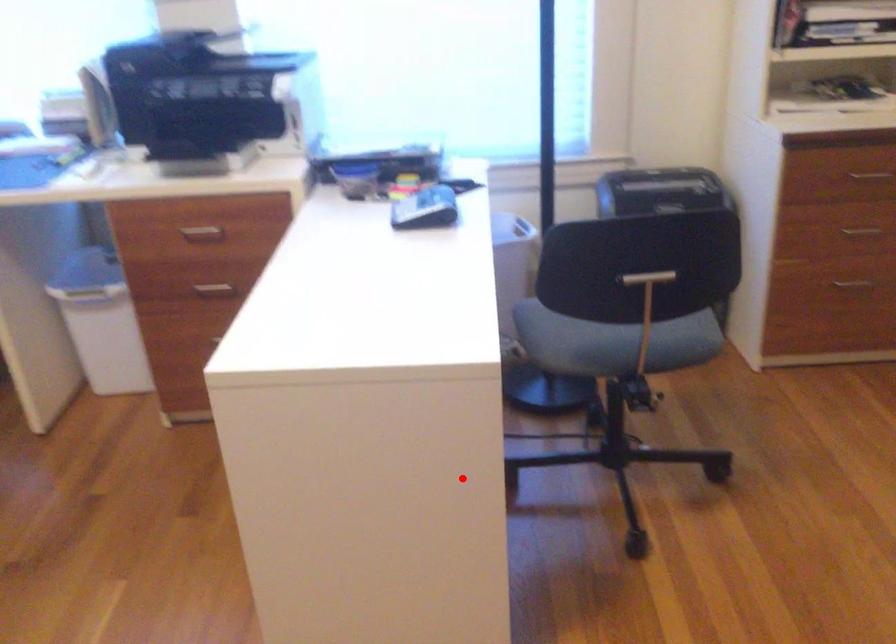
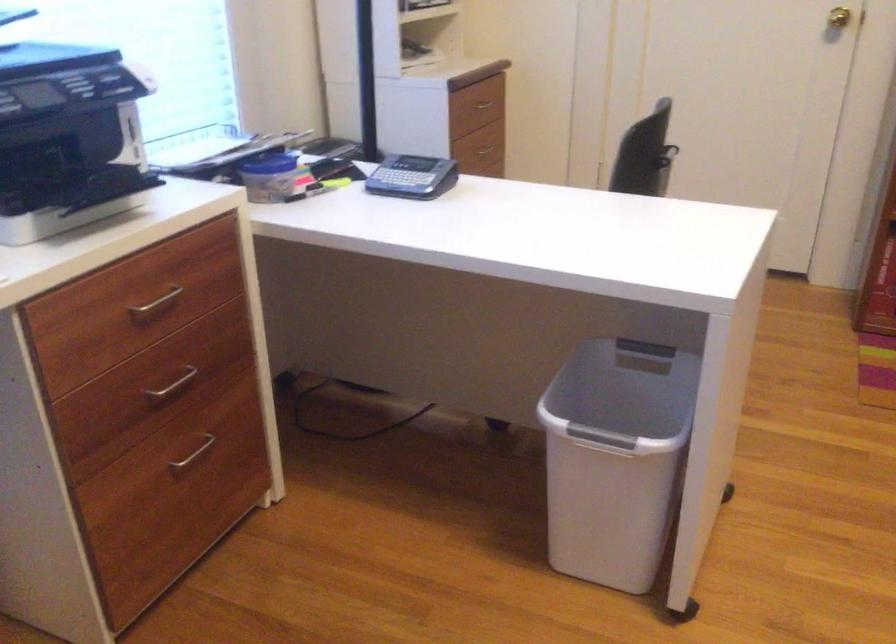
Question: I am providing you with two images of the same scene from different viewpoints. Image1 has a red point marked. In image2, the corresponding 3D location appears at what relative position? Reply with the corresponding letter.

Choices:
 (A) Closer
 (B) Farther

Answer: (B)